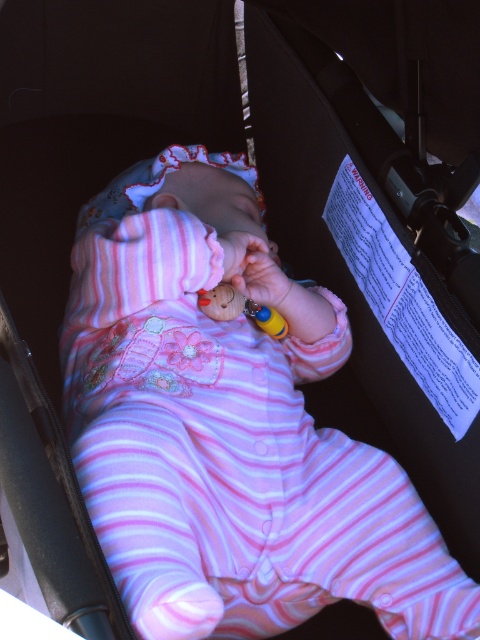
You are a parent trying to give your baby either the wooden toy at center or the rubber teething ring at center. Considering the baby is currently sucking on a pacifier attached to their clothing, which item can the baby hold in their hands while still keeping the pacifier in their mouth?

The wooden toy at center is larger in size than the rubber teething ring at center, so the baby can hold the wooden toy at center in their hands while keeping the pacifier in their mouth since it requires more grip space.

You are a photographer trying to capture a closeup of the wooden toy at center while the baby is in the pink striped fabric baby at center. Since the baby is in the way, can you adjust your position to focus on the wooden toy without moving the baby?

The pink striped fabric baby at center is closer to the viewer than wooden toy at center, so you can move your camera position slightly behind the baby to focus on the wooden toy at center while keeping the baby in frame but not blocking the toy.

Based on the image, what is located at the coordinates point (229, 428)?

The point (229, 428) marks the pink striped fabric baby at center.